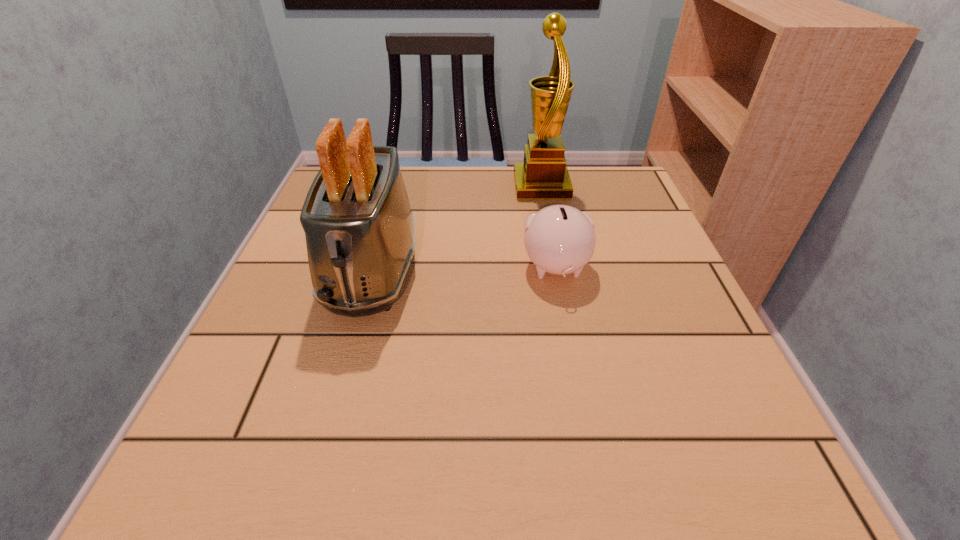
Find the location of a particular element. The image size is (960, 540). award is located at coordinates (543, 175).

At what (x,y) coordinates should I click in order to perform the action: click on the tallest object. Please return your answer as a coordinate pair (x, y). The image size is (960, 540). Looking at the image, I should click on (543, 175).

Find the location of `toaster`. toaster is located at coordinates (359, 228).

The image size is (960, 540). Identify the location of the leftmost object. (359, 228).

Identify the location of the shortest object. This screenshot has width=960, height=540. (559, 239).

Find the location of `free location located 0.160m on the front-facing side of the farthest object`. free location located 0.160m on the front-facing side of the farthest object is located at coordinates (450, 186).

Where is `free space located 0.230m on the front-facing side of the farthest object`? free space located 0.230m on the front-facing side of the farthest object is located at coordinates (421, 186).

Identify the location of vacant space situated on the front-facing side of the farthest object. (478, 186).

Locate an element on the screen. The width and height of the screenshot is (960, 540). vacant space located 0.270m on the side of the second tallest object with the control lever is located at coordinates (310, 497).

Where is `blank space located 0.140m on the right of the shortest object`? The image size is (960, 540). blank space located 0.140m on the right of the shortest object is located at coordinates (661, 268).